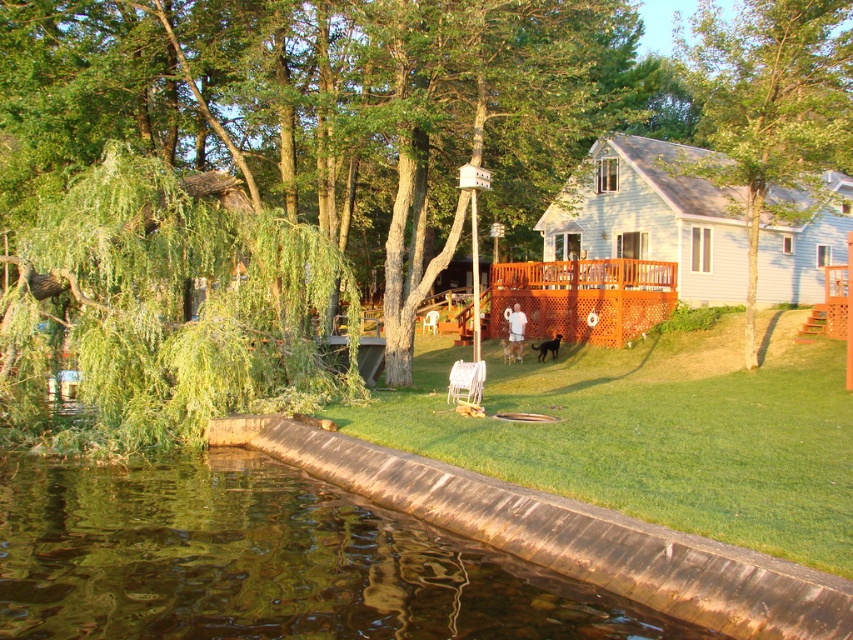
Question: Is green leafy tree at left closer to camera compared to green leafy tree at center?

Choices:
 (A) yes
 (B) no

Answer: (A)

Question: Does green leafy tree at left appear on the right side of white plastic chair at center?

Choices:
 (A) no
 (B) yes

Answer: (A)

Question: Which point is farther from the camera taking this photo?

Choices:
 (A) (276, 616)
 (B) (805, 157)
 (C) (463, 390)

Answer: (B)

Question: Which of the following is the farthest from the observer?

Choices:
 (A) green leafy tree at left
 (B) brown lattice deck at center

Answer: (B)

Question: Which object appears farthest from the camera in this image?

Choices:
 (A) green leafy tree at center
 (B) brown concrete water at lower left

Answer: (A)

Question: Is green leafy tree at left thinner than green leafy tree at center?

Choices:
 (A) yes
 (B) no

Answer: (A)